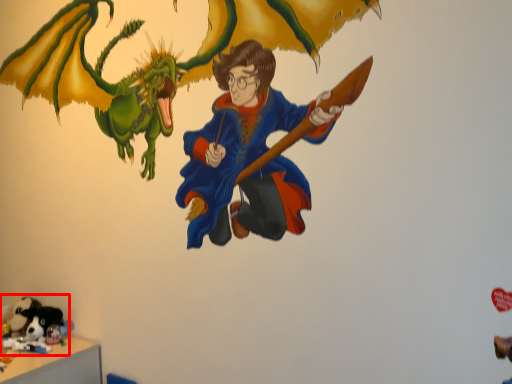
Question: From the image's perspective, what is the correct spatial positioning of toy (annotated by the red box) in reference to animal?

Choices:
 (A) above
 (B) below

Answer: (A)